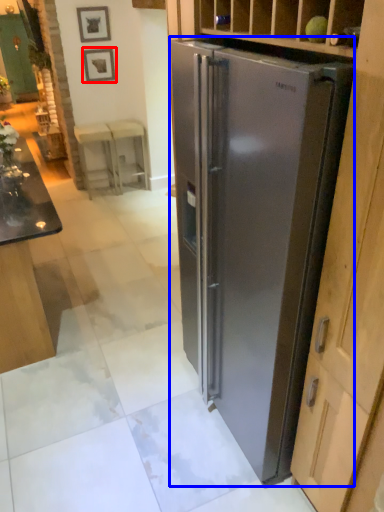
Question: Which of the following is the farthest to the observer, picture frame (highlighted by a red box) or refrigerator (highlighted by a blue box)?

Choices:
 (A) picture frame
 (B) refrigerator

Answer: (A)